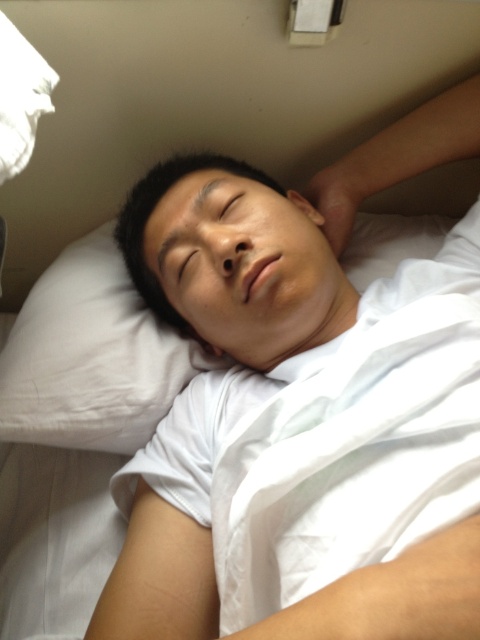
Does white soft pillow at center appear over black matte eye at upper center?

Actually, white soft pillow at center is below black matte eye at upper center.

Is point (112, 440) positioned before point (248, 182)?

No, (112, 440) is further to viewer.

You are a GUI agent. You are given a task and a screenshot of the screen. Output one action in this format:
    pyautogui.click(x=<x>, y=<y>)
    Task: Click on the white soft pillow at center
    
    Given the screenshot: What is the action you would take?
    pyautogui.click(x=91, y=356)

Which is above, white cotton shirt at center or white soft pillow at center?

Positioned higher is white soft pillow at center.

Is point (304, 321) in front of point (69, 417)?

Yes, point (304, 321) is in front of point (69, 417).

What are the coordinates of `white cotton shirt at center` in the screenshot? It's located at (238, 262).

How much distance is there between smooth skin head at center and brown matte eye at center?

smooth skin head at center is 2.88 inches from brown matte eye at center.

Does smooth skin head at center appear over brown matte eye at center?

Yes.

Does point (340, 308) come behind point (192, 252)?

Yes, it is behind point (192, 252).

What are the coordinates of `smooth skin head at center` in the screenshot? It's located at (237, 262).